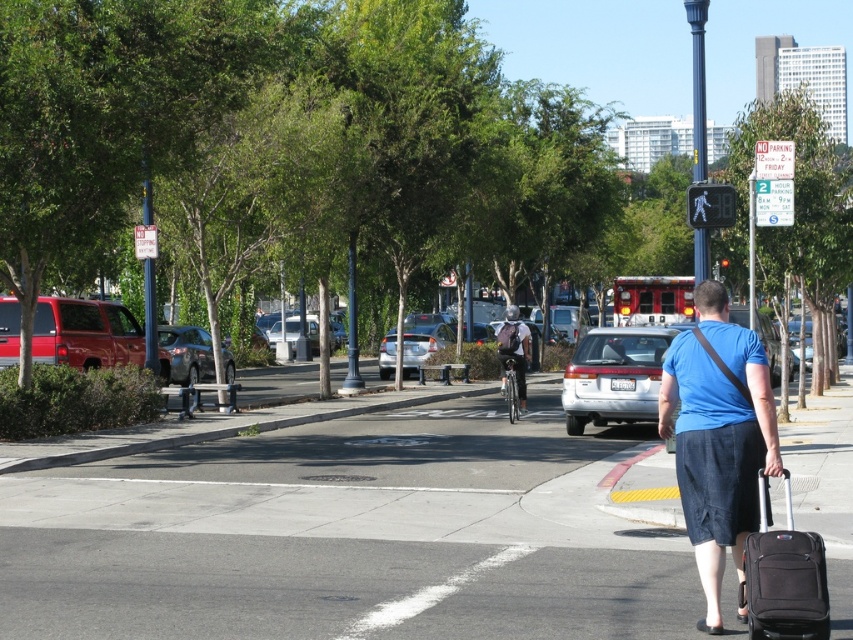
You are standing at the point with coordinates point (195, 374) and want to walk to the point with coordinates point (45, 342). According to the scene, which direction should you face to move towards your destination?

You should face towards the front because point (45, 342) is in front of point (195, 374).

You are a delivery person standing at the crosswalk, holding a matte black backpack at center. You need to place it in the trunk of the matte red suv at left. Can you easily reach the trunk from your current position?

The matte red suv at left is to the left of the matte black backpack at center. Since the SUV is parked on the left side of the road and you are at the crosswalk, you would need to walk around to the passenger side of the SUV to access the trunk, which may not be directly accessible from your current position at the crosswalk.

You are a delivery person carrying a matte black backpack at center and need to place it into the trunk of the matte red suv at left. Considering their sizes, will the backpack fit inside the trunk?

The matte red suv at left has a smaller size compared to the matte black backpack at center, so the backpack may not fit inside the trunk due to the SUV being smaller in size.